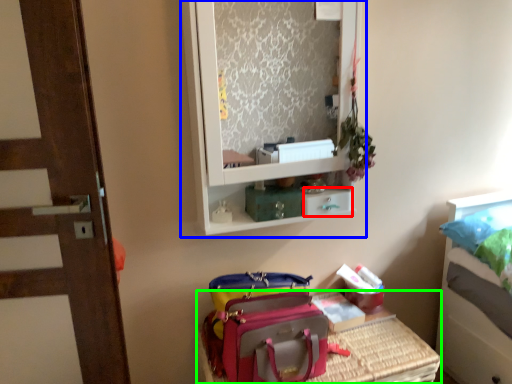
Question: Based on their relative distances, which object is nearer to drawer (highlighted by a red box)? Choose from medicine cabinet (highlighted by a blue box) and furniture (highlighted by a green box).

Choices:
 (A) medicine cabinet
 (B) furniture

Answer: (B)